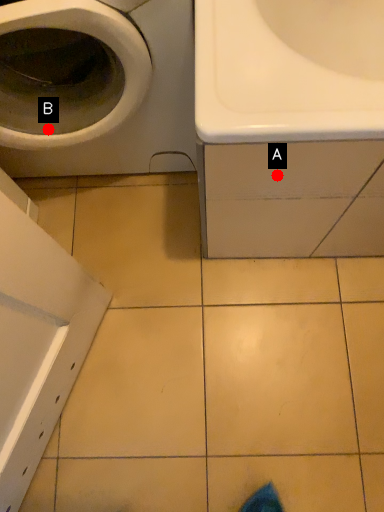
Question: Two points are circled on the image, labeled by A and B beside each circle. Which point is further to the camera?

Choices:
 (A) A is further
 (B) B is further

Answer: (B)